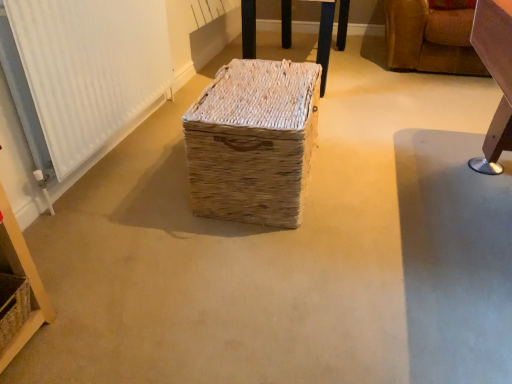
Question: Considering the relative sizes of white textured radiator at left and natural woven basket at center, which ranks as the first furniture in left-to-right order, in the image provided, is white textured radiator at left smaller than natural woven basket at center, which ranks as the first furniture in left-to-right order,?

Choices:
 (A) no
 (B) yes

Answer: (B)

Question: From a real-world perspective, is white textured radiator at left over natural woven basket at center, which ranks as the first furniture in left-to-right order?

Choices:
 (A) yes
 (B) no

Answer: (A)

Question: Is white textured radiator at left thinner than natural woven basket at center, the second furniture positioned from the right?

Choices:
 (A) yes
 (B) no

Answer: (A)

Question: Is white textured radiator at left far from natural woven basket at center, which ranks as the first furniture in left-to-right order?

Choices:
 (A) yes
 (B) no

Answer: (A)

Question: Does white textured radiator at left appear on the right side of natural woven basket at center, which ranks as the first furniture in left-to-right order?

Choices:
 (A) yes
 (B) no

Answer: (B)

Question: Is natural woven basket at lower left in front of or behind white textured radiator at left in the image?

Choices:
 (A) behind
 (B) front

Answer: (B)

Question: From the image's perspective, is natural woven basket at lower left positioned above or below white textured radiator at left?

Choices:
 (A) above
 (B) below

Answer: (B)

Question: In terms of width, does natural woven basket at lower left look wider or thinner when compared to white textured radiator at left?

Choices:
 (A) wide
 (B) thin

Answer: (A)

Question: Is natural woven basket at lower left taller or shorter than white textured radiator at left?

Choices:
 (A) tall
 (B) short

Answer: (B)

Question: In terms of width, does natural woven basket at lower left look wider or thinner when compared to natural woven basket at center?

Choices:
 (A) thin
 (B) wide

Answer: (A)

Question: Is natural woven basket at lower left to the left or to the right of natural woven basket at center in the image?

Choices:
 (A) left
 (B) right

Answer: (A)

Question: Is natural woven basket at lower left inside the boundaries of natural woven basket at center, or outside?

Choices:
 (A) inside
 (B) outside

Answer: (B)

Question: From the image's perspective, is natural woven basket at lower left located above or below natural woven basket at center?

Choices:
 (A) above
 (B) below

Answer: (B)

Question: From the image's perspective, is white textured radiator at left located above or below natural woven basket at lower left?

Choices:
 (A) above
 (B) below

Answer: (A)

Question: In terms of size, does white textured radiator at left appear bigger or smaller than natural woven basket at lower left?

Choices:
 (A) small
 (B) big

Answer: (B)